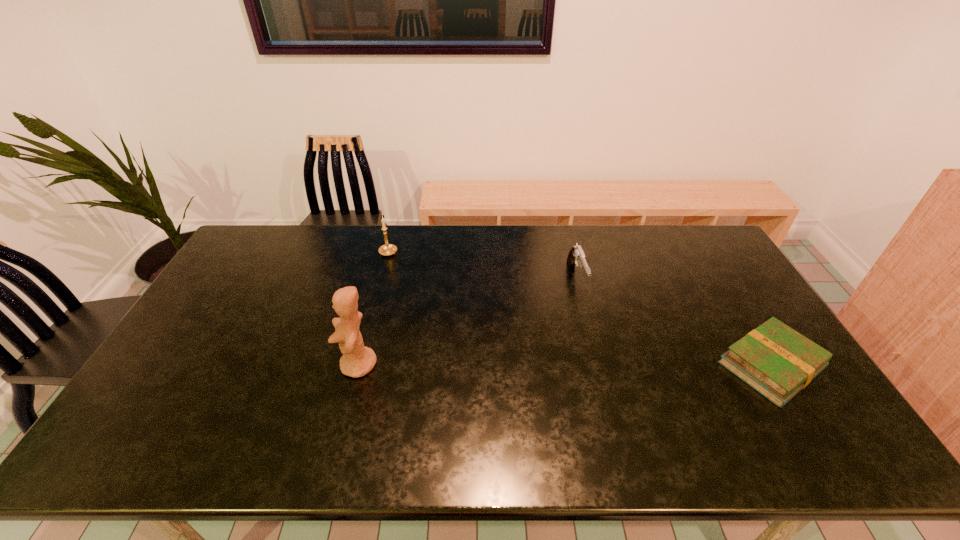
At what (x,y) coordinates should I click in order to perform the action: click on object that is at the right edge. Please return your answer as a coordinate pair (x, y). This screenshot has height=540, width=960. Looking at the image, I should click on (774, 359).

Where is `object present at the near right corner`? This screenshot has width=960, height=540. object present at the near right corner is located at coordinates (774, 359).

Image resolution: width=960 pixels, height=540 pixels. Identify the location of vacant space at the far edge of the desktop. (582, 244).

At what (x,y) coordinates should I click in order to perform the action: click on free region at the near edge of the desktop. Please return your answer as a coordinate pair (x, y). Looking at the image, I should click on (264, 404).

Locate an element on the screen. Image resolution: width=960 pixels, height=540 pixels. free space at the left edge of the desktop is located at coordinates (240, 277).

Find the location of a particular element. free spot at the right edge of the desktop is located at coordinates (744, 296).

Find the location of a particular element. The image size is (960, 540). free space between the tallest object and the third object from left to right is located at coordinates (468, 321).

The image size is (960, 540). What are the coordinates of `unoccupied area between the gun and the candle holder` in the screenshot? It's located at (482, 266).

Locate an element on the screen. This screenshot has width=960, height=540. free space that is in between the book and the candle holder is located at coordinates (580, 309).

Identify the location of vacant area that lies between the figurine and the gun. (468, 321).